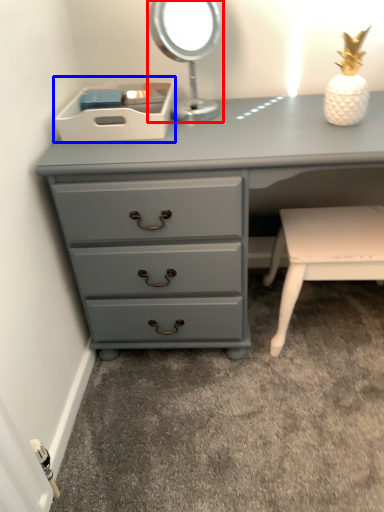
Question: Among these objects, which one is farthest to the camera, bedside lamp (highlighted by a red box) or storage box (highlighted by a blue box)?

Choices:
 (A) bedside lamp
 (B) storage box

Answer: (B)